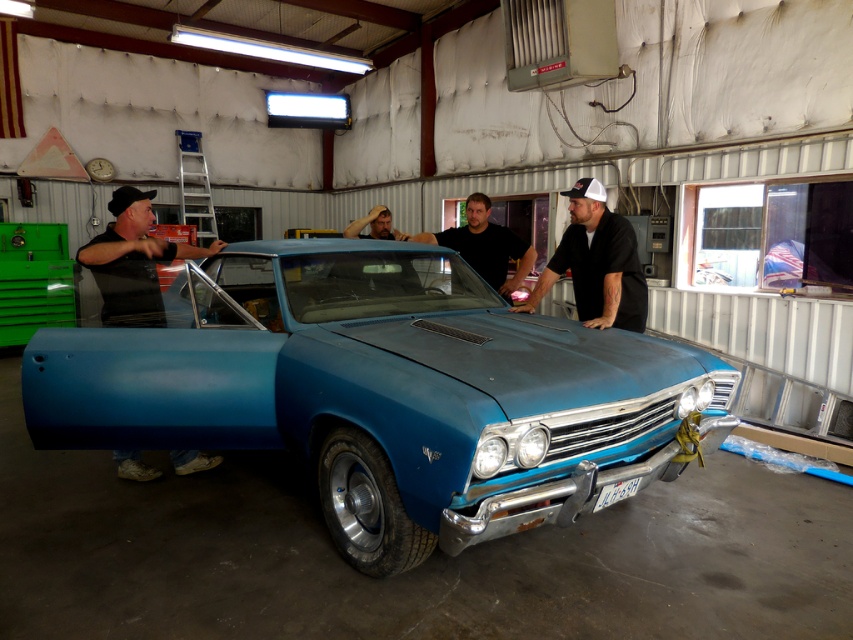
Can you confirm if blue matte car at center is taller than matte black shirt at center?

Indeed, blue matte car at center has a greater height compared to matte black shirt at center.

Is blue matte car at center wider than matte black shirt at center?

Correct, the width of blue matte car at center exceeds that of matte black shirt at center.

Between point (238, 250) and point (512, 250), which one is positioned behind?

The point (512, 250) is more distant.

Identify the location of blue matte car at center. (383, 392).

Who is shorter, blue matte car at center or black matte shirt at center?

Standing shorter between the two is black matte shirt at center.

The width and height of the screenshot is (853, 640). I want to click on blue matte car at center, so click(383, 392).

Can you confirm if black matte shirt at left is positioned above matte black shirt at center?

Incorrect, black matte shirt at left is not positioned above matte black shirt at center.

Between black matte shirt at left and matte black shirt at center, which one appears on the left side from the viewer's perspective?

black matte shirt at left

Does point (131, 220) come in front of point (512, 252)?

That is True.

Where is `black matte shirt at left`? black matte shirt at left is located at coordinates (132, 260).